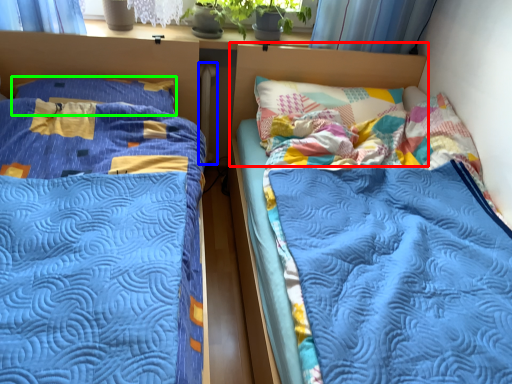
Question: Which is farther away from headboard (highlighted by a red box)? radiator (highlighted by a blue box) or pillow (highlighted by a green box)?

Choices:
 (A) radiator
 (B) pillow

Answer: (B)